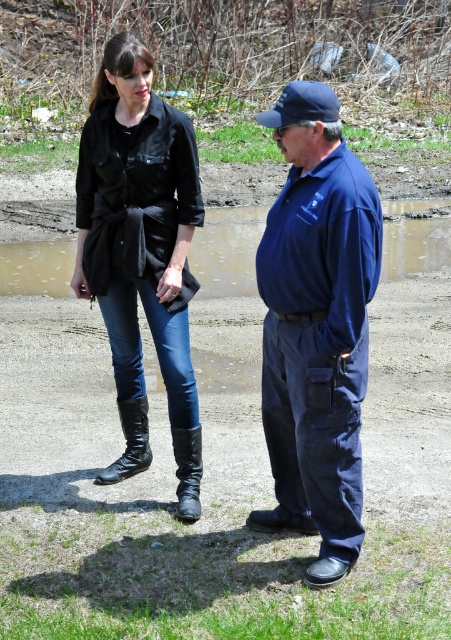
Is point (330, 424) in front of point (171, 220)?

That is True.

Who is more forward, (x=110, y=118) or (x=152, y=209)?

Point (x=152, y=209)

Image resolution: width=451 pixels, height=640 pixels. I want to click on black leather boots at lower left, so coord(317,326).

Is black leather boots at lower left wider than black leather boot at lower left?

Indeed, black leather boots at lower left has a greater width compared to black leather boot at lower left.

Who is shorter, black leather boots at lower left or black leather boot at lower left?

black leather boot at lower left is shorter.

The height and width of the screenshot is (640, 451). Describe the element at coordinates (317, 326) in the screenshot. I see `black leather boots at lower left` at that location.

This screenshot has height=640, width=451. What are the coordinates of `black leather boots at lower left` in the screenshot? It's located at (317, 326).

Who is lower down, black leather boots at lower left or navy blue uniform at center?

Positioned lower is navy blue uniform at center.

In the scene shown: Between black leather boots at lower left and navy blue uniform at center, which one appears on the left side from the viewer's perspective?

From the viewer's perspective, black leather boots at lower left appears more on the left side.

Find the location of a particular element. black leather boots at lower left is located at coordinates (317, 326).